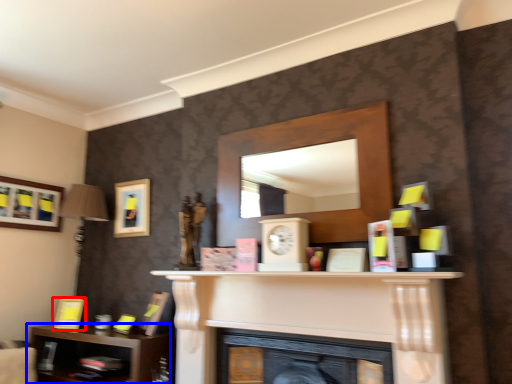
Question: Which of the following is the farthest to the observer, picture frame (highlighted by a red box) or shelf (highlighted by a blue box)?

Choices:
 (A) picture frame
 (B) shelf

Answer: (A)